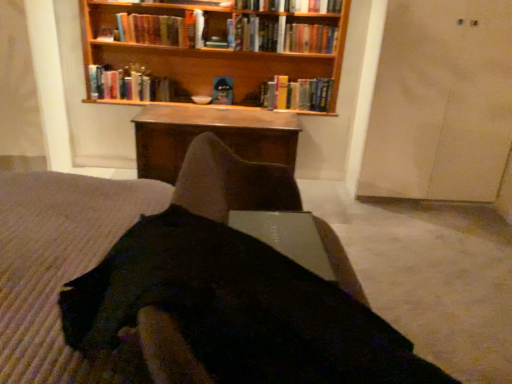
Question: Considering the relative positions of black fabric dress at center and wooden bookshelf at upper center in the image provided, is black fabric dress at center to the left or to the right of wooden bookshelf at upper center?

Choices:
 (A) right
 (B) left

Answer: (A)

Question: Based on their sizes in the image, would you say black fabric dress at center is bigger or smaller than wooden bookshelf at upper center?

Choices:
 (A) big
 (B) small

Answer: (B)

Question: Estimate the real-world distances between objects in this image. Which object is closer to the hardcover book at upper center, the 2th book when ordered from left to right?

Choices:
 (A) black fabric dress at center
 (B) hardcover book at center, the 4th book when ordered from right to left
 (C) metallic silver laptop at center
 (D) wooden table at center
 (E) hardcover book at upper center, placed as the 5th book when sorted from left to right

Answer: (B)

Question: Which of these objects is positioned farthest from the hardcover book at center, the first book positioned from the right?

Choices:
 (A) hardcover book at center, marked as the first book in a left-to-right arrangement
 (B) metallic silver laptop at center
 (C) hardcover book at center, acting as the third book starting from the left
 (D) hardcover book at upper center, the 2th book from the right
 (E) hardcover book at upper center, the 2th book when ordered from left to right

Answer: (B)